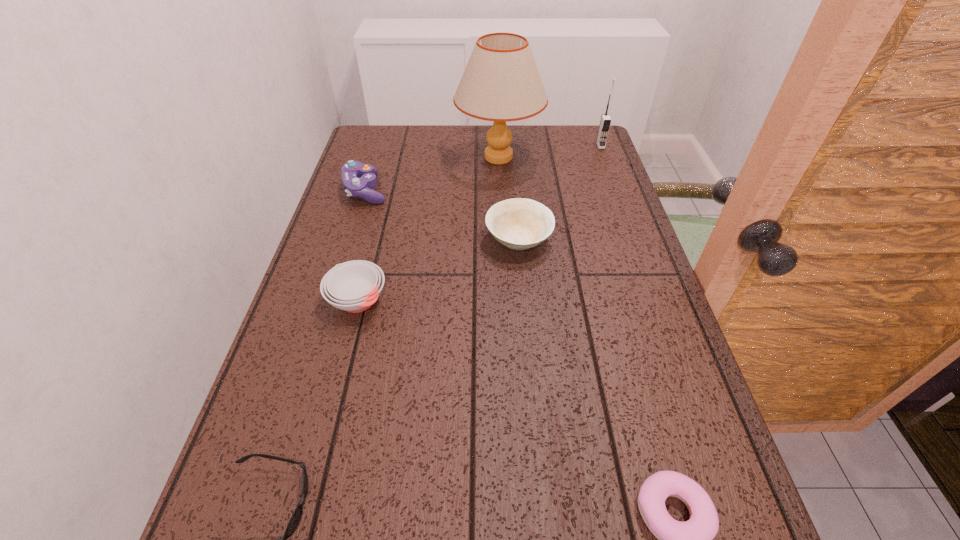
Where is `free region located on the front of the soup bowl`? free region located on the front of the soup bowl is located at coordinates (339, 376).

Identify the location of lampshade at the far edge. (501, 83).

At what (x,y) coordinates should I click in order to perform the action: click on cellular telephone positioned at the far edge. Please return your answer as a coordinate pair (x, y). This screenshot has width=960, height=540. Looking at the image, I should click on (605, 122).

Locate an element on the screen. control at the left edge is located at coordinates (354, 186).

Find the location of `soup bowl that is positioned at the left edge`. soup bowl that is positioned at the left edge is located at coordinates (354, 286).

I want to click on object positioned at the right edge, so click(605, 122).

This screenshot has width=960, height=540. In order to click on object that is at the far right corner in this screenshot , I will do coord(605,122).

In the image, there is a desktop. At what (x,y) coordinates should I click in order to perform the action: click on vacant space at the far edge. Please return your answer as a coordinate pair (x, y). Looking at the image, I should click on (440, 138).

This screenshot has width=960, height=540. In the image, there is a desktop. In order to click on vacant space at the left edge in this screenshot , I will do `click(339, 256)`.

The width and height of the screenshot is (960, 540). Find the location of `free space at the right edge`. free space at the right edge is located at coordinates (620, 342).